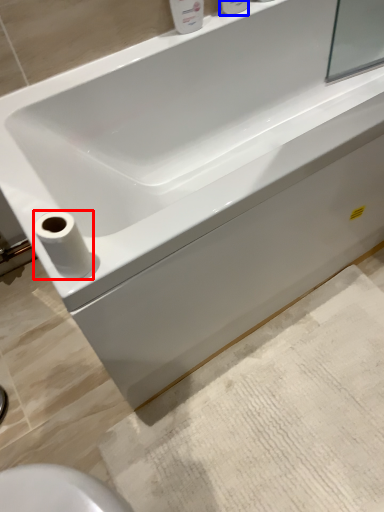
Question: Which of the following is the closest to the observer, toilet paper (highlighted by a red box) or toiletry (highlighted by a blue box)?

Choices:
 (A) toilet paper
 (B) toiletry

Answer: (A)